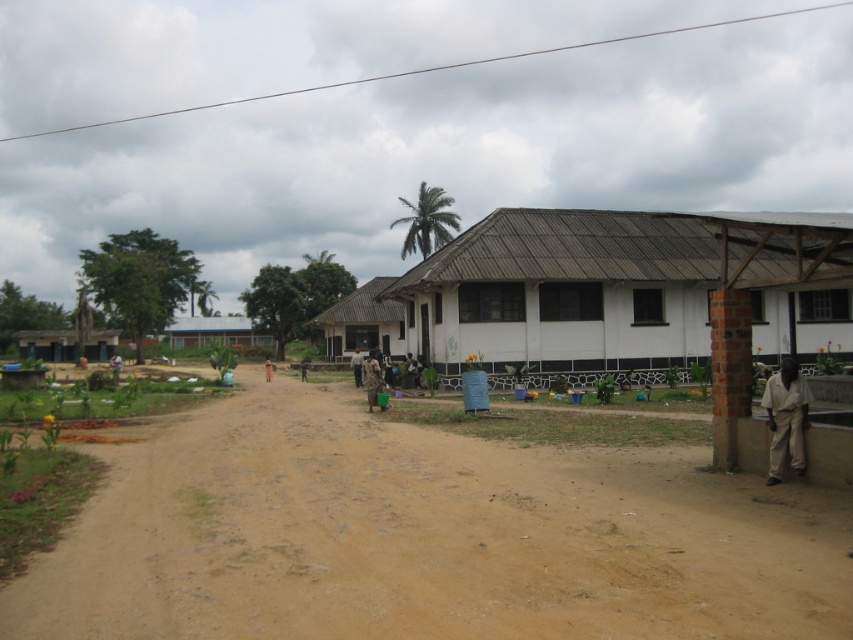
Question: Is blue corrugated metal hut at center below brown fabric person at center?

Choices:
 (A) no
 (B) yes

Answer: (A)

Question: Which point is closer to the camera?

Choices:
 (A) brown fabric bag at center
 (B) blue corrugated metal hut at center
 (C) camouflage fabric person at center

Answer: (C)

Question: Is the position of light brown fabric pants at lower right less distant than that of camouflage fabric person at center?

Choices:
 (A) yes
 (B) no

Answer: (A)

Question: Is blue corrugated metal hut at center thinner than brown fabric person at center?

Choices:
 (A) no
 (B) yes

Answer: (A)

Question: Which of the following is the closest to the observer?

Choices:
 (A) (550, 320)
 (B) (367, 378)
 (C) (48, 344)

Answer: (B)

Question: Which object appears farthest from the camera in this image?

Choices:
 (A) light brown fabric pants at lower right
 (B) blue corrugated metal hut at center
 (C) matte blue hut at left
 (D) camouflage fabric person at center

Answer: (B)